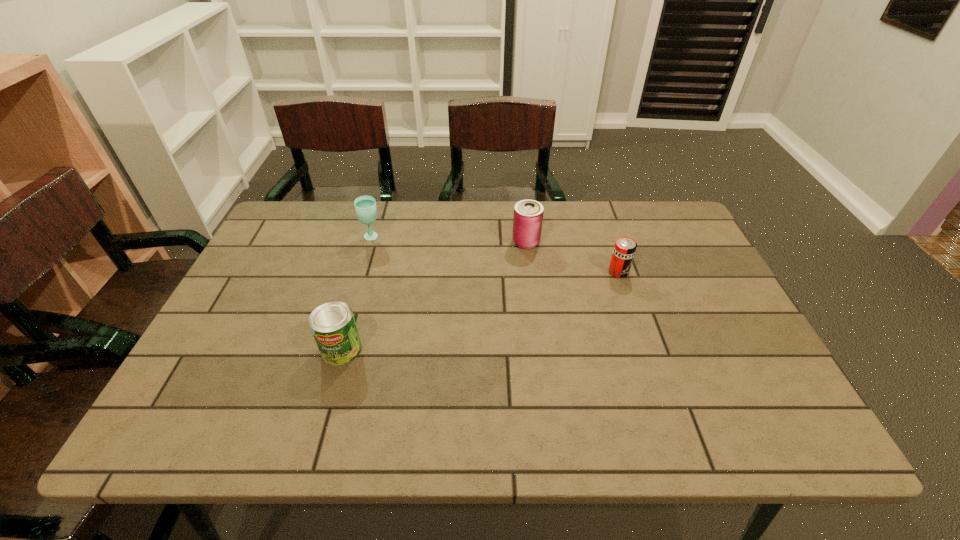
This screenshot has width=960, height=540. What are the coordinates of `vacant space at the near right corner of the desktop` in the screenshot? It's located at (800, 435).

Locate an element on the screen. blank region between the glass and the leftmost can is located at coordinates pos(357,293).

Image resolution: width=960 pixels, height=540 pixels. Find the location of `vacant space in between the glass and the nearest object`. vacant space in between the glass and the nearest object is located at coordinates (357, 293).

Where is `vacant area between the glass and the rightmost can`? The image size is (960, 540). vacant area between the glass and the rightmost can is located at coordinates (495, 254).

Where is `vacant space that is in between the glass and the nearest object`? vacant space that is in between the glass and the nearest object is located at coordinates (357, 293).

Identify the location of vacant space that's between the nearest can and the third object from left to right. (434, 295).

In order to click on free spot between the glass and the rightmost can in this screenshot , I will do `click(495, 254)`.

Find the location of a particular element. blank region between the rightmost object and the glass is located at coordinates (495, 254).

At what (x,y) coordinates should I click in order to perform the action: click on free space between the rightmost object and the second can from right to left. Please return your answer as a coordinate pair (x, y). This screenshot has width=960, height=540. Looking at the image, I should click on (572, 256).

The image size is (960, 540). In order to click on free spot between the rightmost object and the farthest can in this screenshot , I will do `click(572, 256)`.